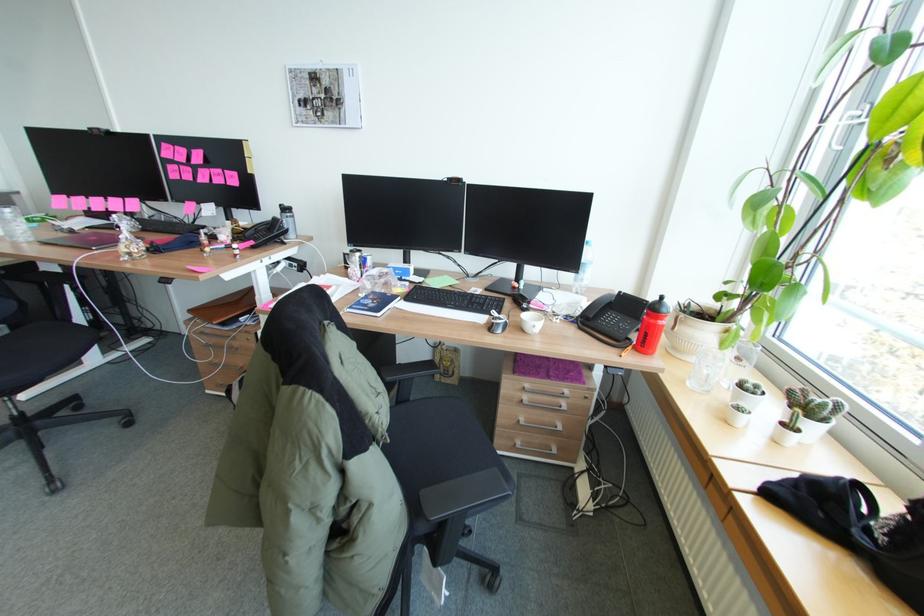
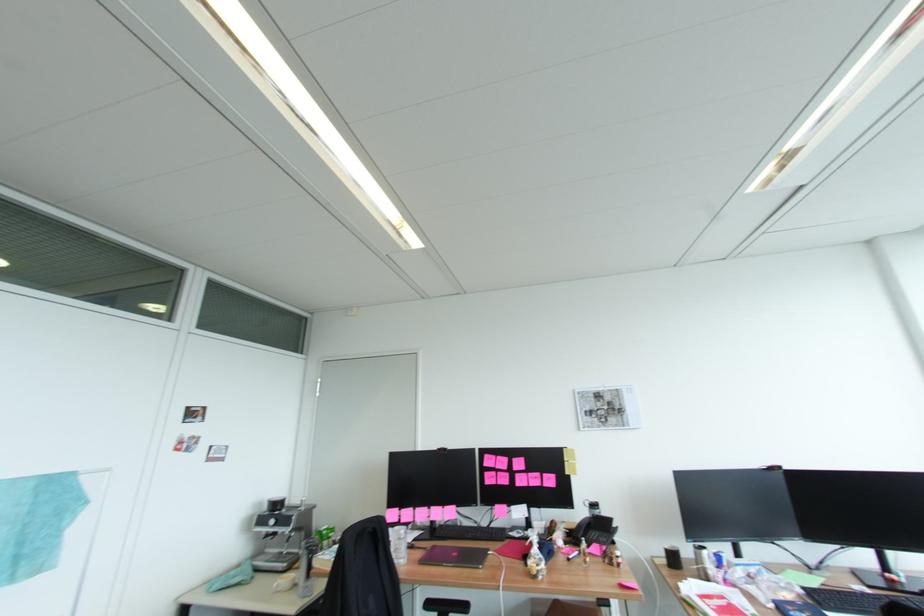
Locate, in the second image, the point that corresponds to point (225, 171) in the first image.

(542, 474)